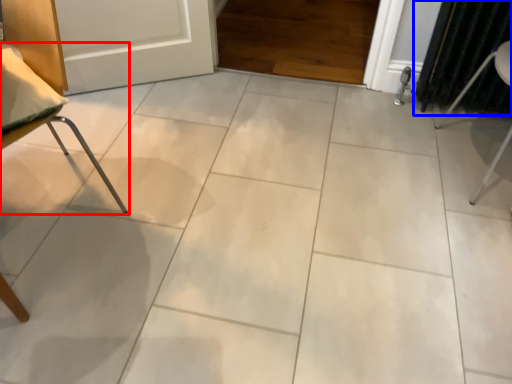
Question: Among these objects, which one is farthest to the camera, furniture (highlighted by a red box) or curtain (highlighted by a blue box)?

Choices:
 (A) furniture
 (B) curtain

Answer: (B)